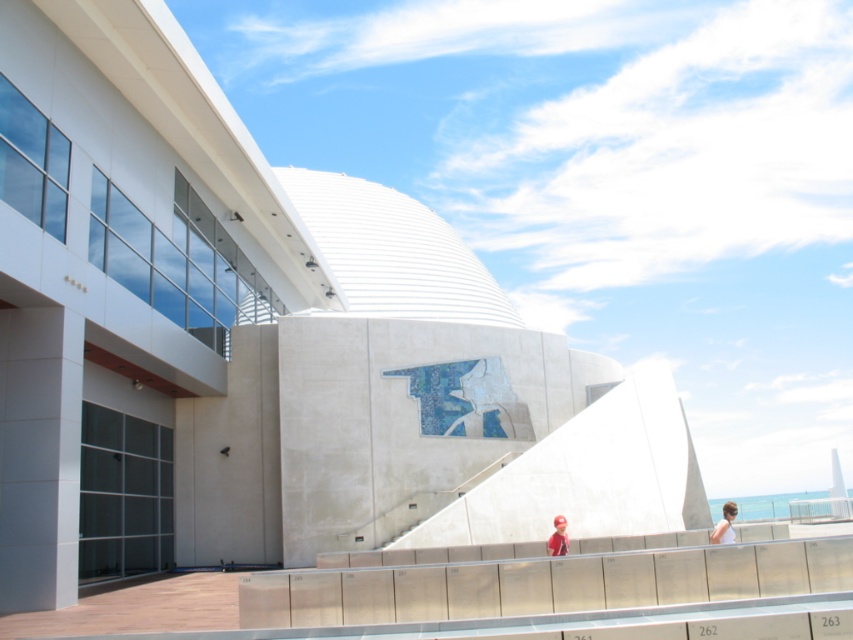
Based on the photo, is white matte shirt at lower right thinner than red cap at lower center?

No.

Find the location of a particular element. Image resolution: width=853 pixels, height=640 pixels. white matte shirt at lower right is located at coordinates (724, 524).

Image resolution: width=853 pixels, height=640 pixels. In order to click on white matte shirt at lower right in this screenshot , I will do `click(724, 524)`.